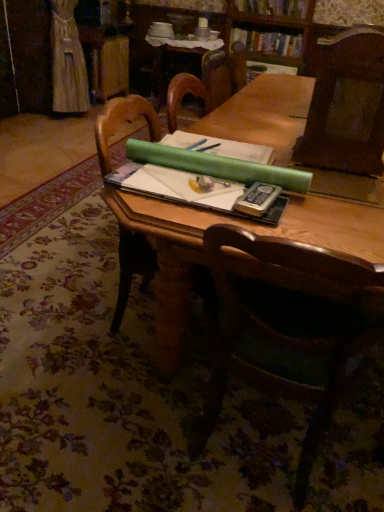
Question: Can you confirm if hardcover book at center is smaller than wooden table at center?

Choices:
 (A) no
 (B) yes

Answer: (B)

Question: From the image's perspective, would you say hardcover book at center is positioned over wooden table at center?

Choices:
 (A) no
 (B) yes

Answer: (B)

Question: Does hardcover book at center turn towards wooden table at center?

Choices:
 (A) no
 (B) yes

Answer: (A)

Question: Considering the relative sizes of hardcover book at center and wooden table at center in the image provided, is hardcover book at center taller than wooden table at center?

Choices:
 (A) no
 (B) yes

Answer: (A)

Question: Is hardcover book at center turned away from wooden table at center?

Choices:
 (A) yes
 (B) no

Answer: (B)

Question: Is the position of hardcover book at center more distant than that of wooden table at center?

Choices:
 (A) yes
 (B) no

Answer: (B)

Question: Is green paper at upper center placed right next to wooden bookcase at upper center?

Choices:
 (A) no
 (B) yes

Answer: (A)

Question: Does green paper at upper center have a lesser width compared to wooden bookcase at upper center?

Choices:
 (A) no
 (B) yes

Answer: (A)

Question: Can you confirm if green paper at upper center is smaller than wooden bookcase at upper center?

Choices:
 (A) yes
 (B) no

Answer: (B)

Question: Is green paper at upper center bigger than wooden bookcase at upper center?

Choices:
 (A) yes
 (B) no

Answer: (A)

Question: From the image's perspective, is green paper at upper center above wooden bookcase at upper center?

Choices:
 (A) no
 (B) yes

Answer: (A)

Question: From a real-world perspective, is green paper at upper center positioned under wooden bookcase at upper center based on gravity?

Choices:
 (A) no
 (B) yes

Answer: (B)

Question: From the image's perspective, would you say wooden table at center is positioned over green matte paper at center?

Choices:
 (A) no
 (B) yes

Answer: (A)